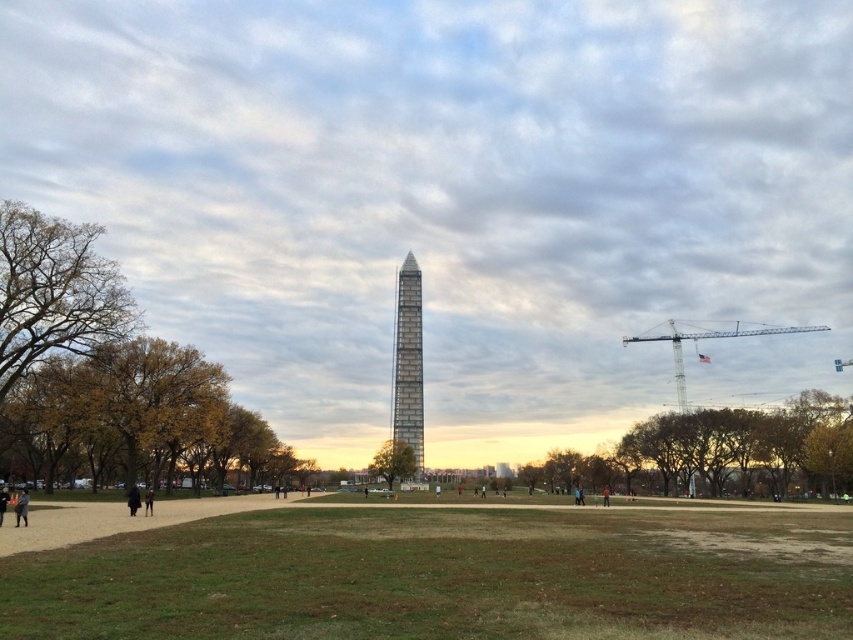
Does black matte coat at lower left have a lesser width compared to black fabric person at lower left?

Indeed, black matte coat at lower left has a lesser width compared to black fabric person at lower left.

Is point (138, 502) less distant than point (149, 493)?

Yes, it is in front of point (149, 493).

The image size is (853, 640). I want to click on black matte coat at lower left, so click(132, 499).

Can you confirm if yellow-green leaves at left is taller than dark gray jacket at lower left?

Indeed, yellow-green leaves at left has a greater height compared to dark gray jacket at lower left.

Which of these two, yellow-green leaves at left or dark gray jacket at lower left, stands taller?

With more height is yellow-green leaves at left.

I want to click on yellow-green leaves at left, so click(137, 420).

Who is lower down, green leafy tree at center or dark gray jacket at lower left?

green leafy tree at center is below.

Is point (390, 464) more distant than point (16, 524)?

Yes, it is behind point (16, 524).

Between point (386, 472) and point (16, 513), which one is positioned behind?

The point (386, 472) is more distant.

This screenshot has height=640, width=853. I want to click on green leafy tree at center, so click(393, 461).